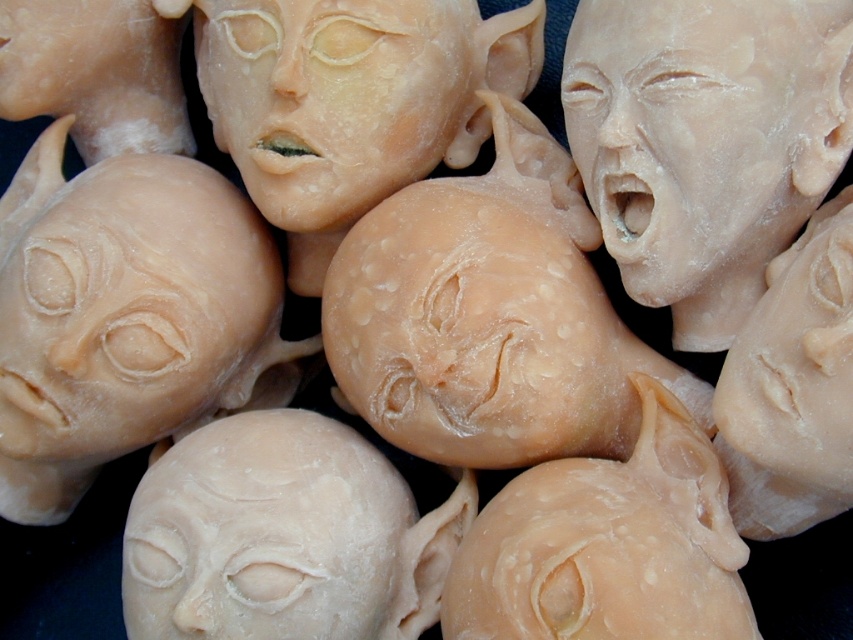
Which of these two, matte beige head at center or matte beige sculpture at center, stands taller?

With more height is matte beige sculpture at center.

Looking at this image, can you confirm if matte beige head at center is wider than matte beige sculpture at center?

Yes.

The height and width of the screenshot is (640, 853). Describe the element at coordinates (283, 536) in the screenshot. I see `matte beige head at center` at that location.

The width and height of the screenshot is (853, 640). I want to click on matte beige head at center, so pos(283,536).

Can you confirm if matte beige head at center is bigger than matte beige sculpture at upper right?

Yes, matte beige head at center is bigger than matte beige sculpture at upper right.

Between matte beige head at center and matte beige sculpture at upper right, which one appears on the right side from the viewer's perspective?

matte beige sculpture at upper right

Consider the image. Who is more distant from viewer, [310,609] or [593,40]?

The point [593,40] is behind.

Identify the location of matte beige head at center. (283, 536).

Is point (670, 177) farther from camera compared to point (386, 118)?

That is False.

Is point (630, 104) closer to viewer compared to point (299, 196)?

Yes, point (630, 104) is in front of point (299, 196).

The image size is (853, 640). In order to click on matte beige sculpture at upper right in this screenshot , I will do click(x=685, y=134).